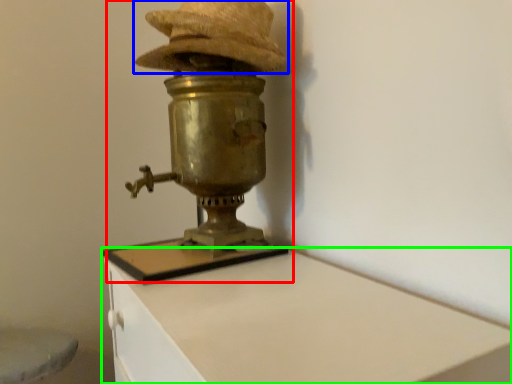
Question: Considering the real-world distances, which object is farthest from table lamp (highlighted by a red box)? hat (highlighted by a blue box) or furniture (highlighted by a green box)?

Choices:
 (A) hat
 (B) furniture

Answer: (B)